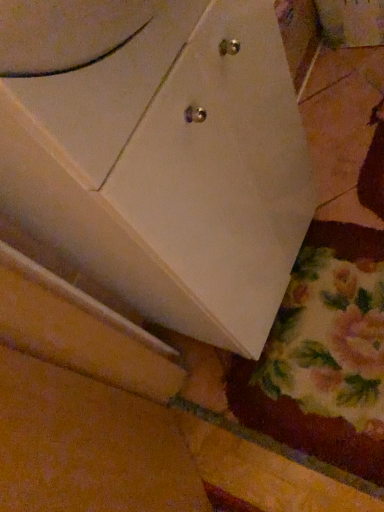
The height and width of the screenshot is (512, 384). Find the location of `white matte cabinet at center`. white matte cabinet at center is located at coordinates (160, 155).

Measure the distance between point [238,76] and camera.

The depth of point [238,76] is 21.81 inches.

Image resolution: width=384 pixels, height=512 pixels. Describe the element at coordinates (160, 155) in the screenshot. I see `white matte cabinet at center` at that location.

This screenshot has height=512, width=384. What are the coordinates of `white matte cabinet at center` in the screenshot? It's located at (160, 155).